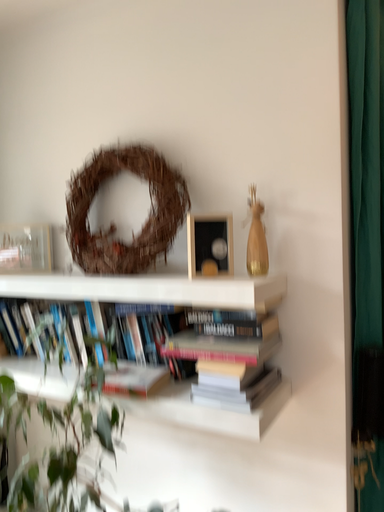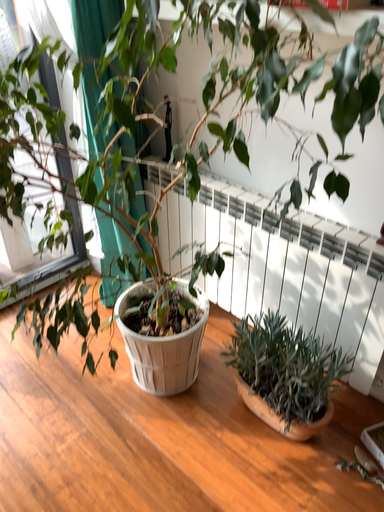
Question: How did the camera likely rotate when shooting the video?

Choices:
 (A) rotated right
 (B) rotated left

Answer: (B)